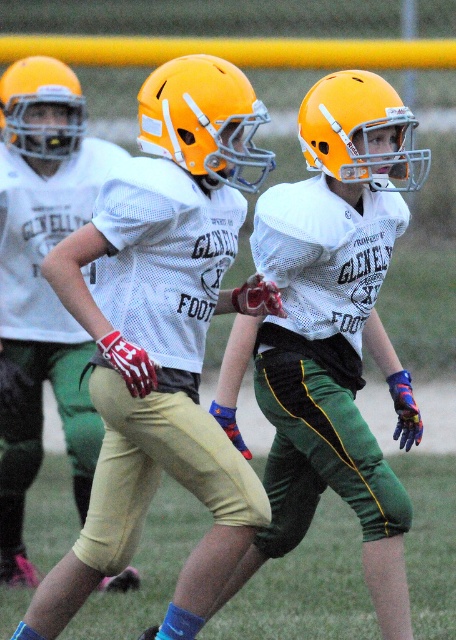
Question: Among these objects, which one is nearest to the camera?

Choices:
 (A) matte yellow helmet at center
 (B) matte yellow helmet at upper left
 (C) matte white jersey at center

Answer: (A)

Question: Among these points, which one is farthest from the camera?

Choices:
 (A) (39, 429)
 (B) (165, 132)

Answer: (A)

Question: Is matte orange helmet at center closer to camera compared to matte yellow helmet at center?

Choices:
 (A) no
 (B) yes

Answer: (B)

Question: Which point is closer to the camera taking this photo?

Choices:
 (A) (238, 132)
 (B) (15, 404)

Answer: (A)

Question: Can you confirm if matte white jersey at center is thinner than matte yellow helmet at upper left?

Choices:
 (A) yes
 (B) no

Answer: (B)

Question: Observing the image, what is the correct spatial positioning of matte white jersey at center in reference to matte orange helmet at center?

Choices:
 (A) right
 (B) left

Answer: (B)